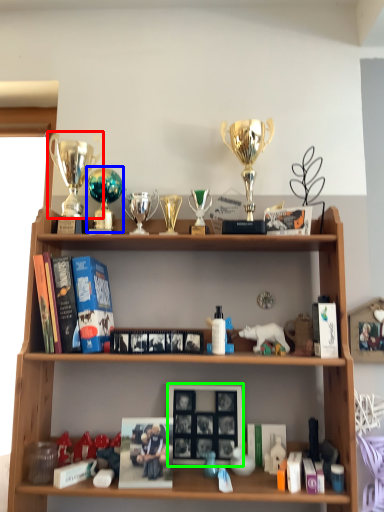
Question: Which object is positioned farthest from trophy (highlighted by a red box)? Select from trophy (highlighted by a blue box) and picture frame (highlighted by a green box).

Choices:
 (A) trophy
 (B) picture frame

Answer: (B)